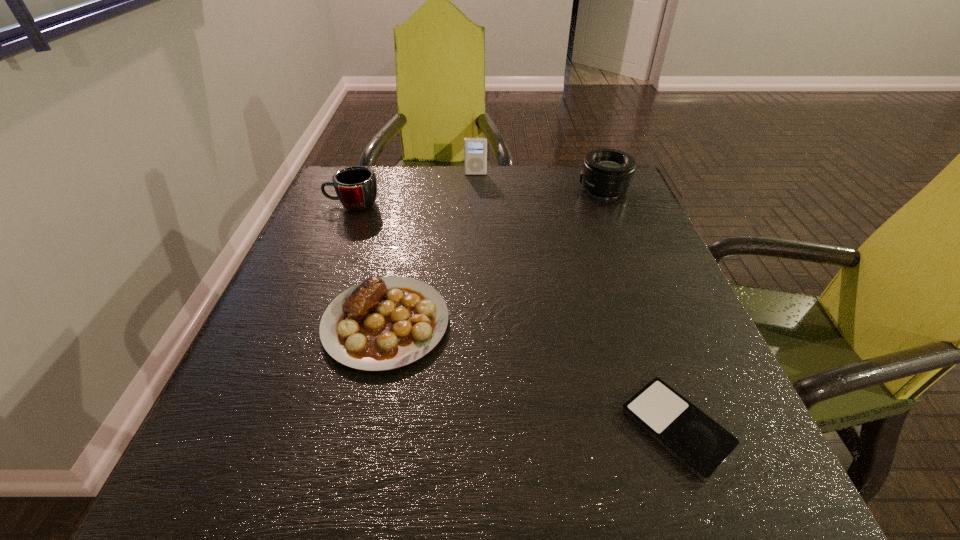
The width and height of the screenshot is (960, 540). I want to click on telephoto lens situated at the right edge, so click(607, 173).

In order to click on iPod that is at the right edge in this screenshot , I will do coord(701,444).

At what (x,y) coordinates should I click in order to perform the action: click on object that is positioned at the far left corner. Please return your answer as a coordinate pair (x, y). The height and width of the screenshot is (540, 960). Looking at the image, I should click on (356, 187).

You are a GUI agent. You are given a task and a screenshot of the screen. Output one action in this format:
    pyautogui.click(x=<x>, y=<y>)
    Task: Click on the object present at the far right corner
    The width and height of the screenshot is (960, 540).
    Given the screenshot: What is the action you would take?
    click(607, 173)

You are a GUI agent. You are given a task and a screenshot of the screen. Output one action in this format:
    pyautogui.click(x=<x>, y=<y>)
    Task: Click on the object present at the near right corner
    
    Given the screenshot: What is the action you would take?
    pyautogui.click(x=701, y=444)

In the image, there is a desktop. Where is `vacant area at the far edge`? Image resolution: width=960 pixels, height=540 pixels. vacant area at the far edge is located at coordinates (543, 177).

The width and height of the screenshot is (960, 540). What are the coordinates of `blank area at the near edge` in the screenshot? It's located at (604, 493).

Where is `free space at the left edge of the desktop`? The width and height of the screenshot is (960, 540). free space at the left edge of the desktop is located at coordinates (372, 242).

Where is `vacant space at the right edge`? vacant space at the right edge is located at coordinates (593, 258).

This screenshot has width=960, height=540. Identify the location of blank area at the near left corner. (250, 504).